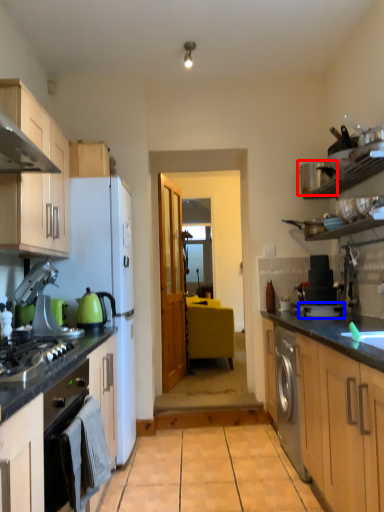
Question: Which object appears farthest to the camera in this image, appliance (highlighted by a red box) or appliance (highlighted by a blue box)?

Choices:
 (A) appliance
 (B) appliance

Answer: (B)